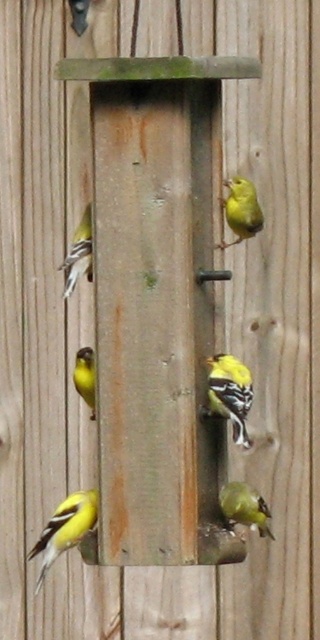
Question: Which object appears closest to the camera in this image?

Choices:
 (A) yellow matte/glossy bird at center
 (B) yellow matte bird at lower center
 (C) matte yellow bird at left
 (D) yellow matte bird at center

Answer: (A)

Question: Is yellow matte bird at center to the left of yellow matte bird at lower center from the viewer's perspective?

Choices:
 (A) no
 (B) yes

Answer: (B)

Question: Considering the real-world distances, which object is farthest from the matte yellow bird at left?

Choices:
 (A) matte yellow bird at center
 (B) yellow matte bird at center
 (C) yellow matte bird at lower center

Answer: (C)

Question: Estimate the real-world distances between objects in this image. Which object is farther from the yellow matte/glossy bird at center?

Choices:
 (A) matte yellow bird at center
 (B) yellow matte bird at lower left
 (C) yellow matte bird at lower center
 (D) matte yellow bird at left

Answer: (B)

Question: Considering the relative positions of yellow matte/glossy bird at center and yellow matte bird at lower left in the image provided, where is yellow matte/glossy bird at center located with respect to yellow matte bird at lower left?

Choices:
 (A) right
 (B) left

Answer: (A)

Question: Can you confirm if yellow matte/glossy bird at center is positioned to the left of matte yellow bird at left?

Choices:
 (A) no
 (B) yes

Answer: (A)